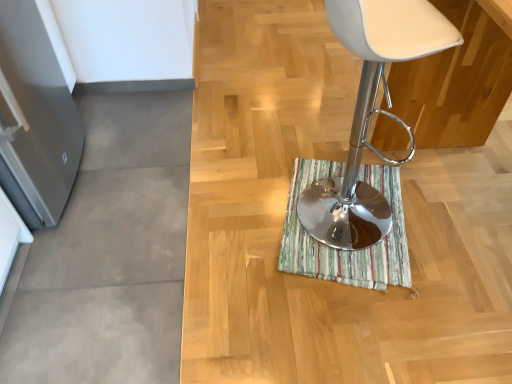
Question: From the image's perspective, would you say white plastic stool at center is positioned over striped fabric bath mat at center?

Choices:
 (A) no
 (B) yes

Answer: (B)

Question: Does white plastic stool at center have a greater width compared to striped fabric bath mat at center?

Choices:
 (A) yes
 (B) no

Answer: (B)

Question: From a real-world perspective, does white plastic stool at center sit lower than striped fabric bath mat at center?

Choices:
 (A) no
 (B) yes

Answer: (A)

Question: Is white plastic stool at center looking in the opposite direction of striped fabric bath mat at center?

Choices:
 (A) yes
 (B) no

Answer: (B)

Question: Considering the relative sizes of white plastic stool at center and striped fabric bath mat at center in the image provided, is white plastic stool at center smaller than striped fabric bath mat at center?

Choices:
 (A) yes
 (B) no

Answer: (B)

Question: Can you confirm if white plastic stool at center is bigger than striped fabric bath mat at center?

Choices:
 (A) yes
 (B) no

Answer: (A)

Question: From the image's perspective, does striped fabric bath mat at center appear higher than white plastic stool at center?

Choices:
 (A) yes
 (B) no

Answer: (B)

Question: From a real-world perspective, does striped fabric bath mat at center stand above white plastic stool at center?

Choices:
 (A) yes
 (B) no

Answer: (B)

Question: From a real-world perspective, is striped fabric bath mat at center below white plastic stool at center?

Choices:
 (A) no
 (B) yes

Answer: (B)

Question: Is striped fabric bath mat at center further to the viewer compared to white plastic stool at center?

Choices:
 (A) yes
 (B) no

Answer: (A)

Question: Considering the relative sizes of striped fabric bath mat at center and white plastic stool at center in the image provided, is striped fabric bath mat at center taller than white plastic stool at center?

Choices:
 (A) yes
 (B) no

Answer: (B)

Question: Can you confirm if striped fabric bath mat at center is positioned to the left of white plastic stool at center?

Choices:
 (A) yes
 (B) no

Answer: (B)

Question: Would you say striped fabric bath mat at center is inside or outside white plastic stool at center?

Choices:
 (A) inside
 (B) outside

Answer: (B)